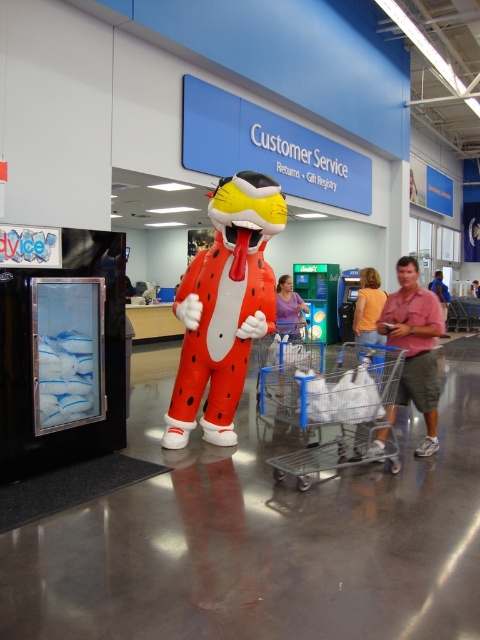
You are a customer in the store and want to place your orange cotton shirt at center into the clear plastic shopping cart at center. Can you do this without moving either item?

The clear plastic shopping cart at center is located below the orange cotton shirt at center, so yes, you can place the orange cotton shirt at center into the clear plastic shopping cart at center since it is positioned above it.

You are a customer holding a pink fabric shirt at center and need to place it into a clear plastic shopping cart at center. Can you reach the shopping cart without moving the shirt?

The clear plastic shopping cart at center is located below the pink fabric shirt at center, so yes, you can reach the shopping cart by lowering your hand from the shirt to the cart below.

You are a customer in the store and want to place the orange cotton shirt at center into the clear plastic shopping cart at center. Can you do this without bending down?

The clear plastic shopping cart at center is much taller than the orange cotton shirt at center, so you would need to bend down to place the orange cotton shirt at center into the clear plastic shopping cart at center.